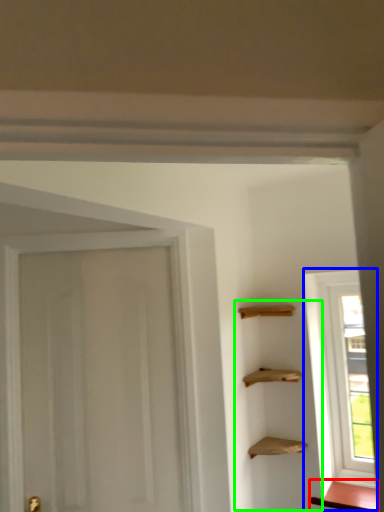
Question: Considering the real-world distances, which object is closest to cabinetry (highlighted by a red box)? window (highlighted by a blue box) or cabinetry (highlighted by a green box).

Choices:
 (A) window
 (B) cabinetry

Answer: (A)